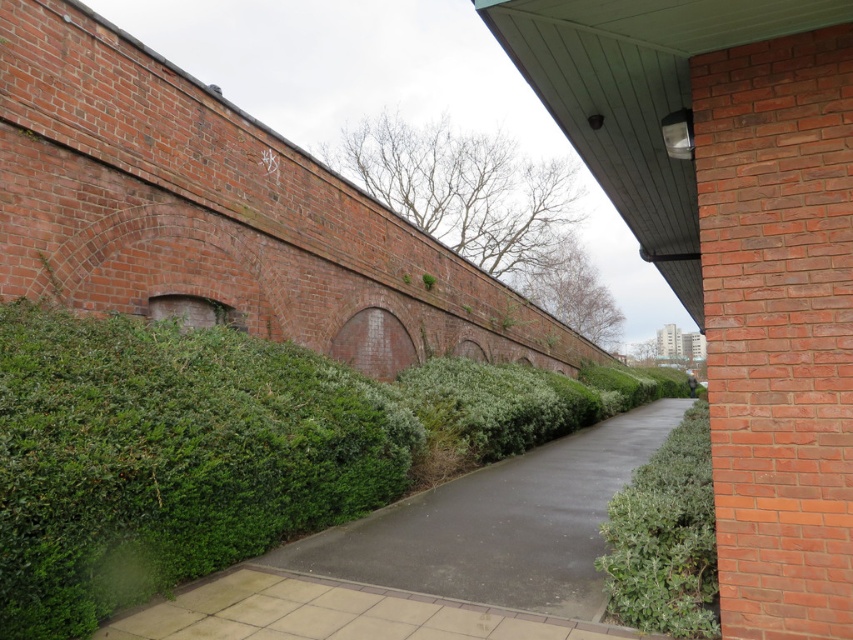
Question: Which of the following is the closest to the observer?

Choices:
 (A) green leafy hedge at right
 (B) green asphalt pavement at center

Answer: (B)

Question: Is green asphalt pavement at center to the left of green leafy hedge at right from the viewer's perspective?

Choices:
 (A) no
 (B) yes

Answer: (A)

Question: Which object is farther from the camera taking this photo?

Choices:
 (A) green leafy hedge at right
 (B) green asphalt pavement at center

Answer: (A)

Question: Among these points, which one is farthest from the camera?

Choices:
 (A) (538, 508)
 (B) (651, 540)

Answer: (A)

Question: Is green asphalt pavement at center above green leafy hedge at right?

Choices:
 (A) no
 (B) yes

Answer: (A)

Question: Is green asphalt pavement at center smaller than green leafy hedge at right?

Choices:
 (A) yes
 (B) no

Answer: (B)